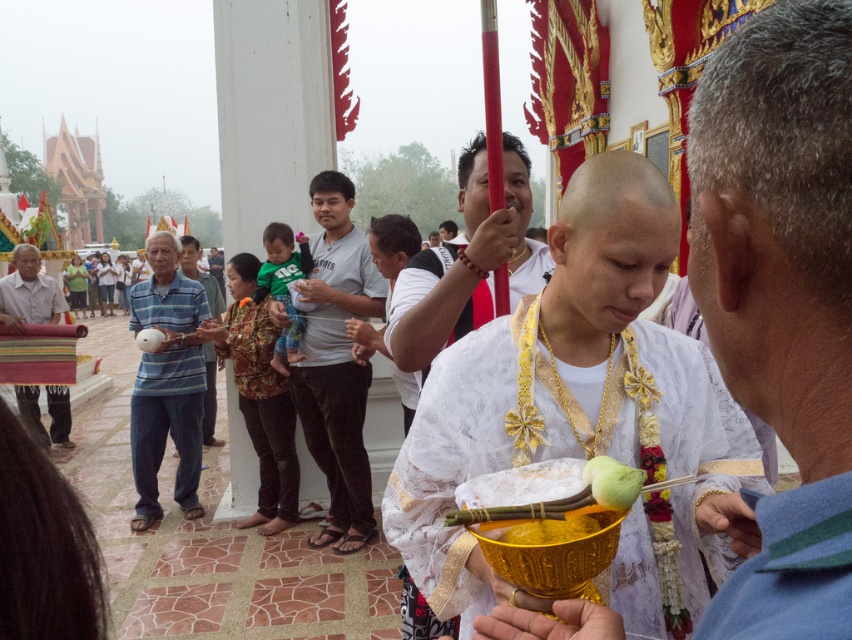
Is multicolored woven cloth at left wider than white matte bowl at center?

Yes, multicolored woven cloth at left is wider than white matte bowl at center.

Does multicolored woven cloth at left appear under white matte bowl at center?

Yes, multicolored woven cloth at left is below white matte bowl at center.

Is point (24, 314) less distant than point (191, 257)?

Yes.

Where is `multicolored woven cloth at left`? multicolored woven cloth at left is located at coordinates (27, 292).

Which is in front, point (711, 444) or point (191, 424)?

Point (711, 444) is more forward.

Can you confirm if white lace robe at center is bigger than striped cotton shirt at left?

No.

Is point (663, 442) positioned after point (170, 371)?

No, it is in front of (170, 371).

Locate an element on the screen. The image size is (852, 640). white lace robe at center is located at coordinates (453, 461).

Does striped cotton shirt at left appear over white matte bowl at center?

Actually, striped cotton shirt at left is below white matte bowl at center.

Is striped cotton shirt at left taller than white matte bowl at center?

In fact, striped cotton shirt at left may be shorter than white matte bowl at center.

Which is behind, point (159, 364) or point (209, 301)?

The point (209, 301) is behind.

Where is `striped cotton shirt at left`? The height and width of the screenshot is (640, 852). striped cotton shirt at left is located at coordinates [x=167, y=381].